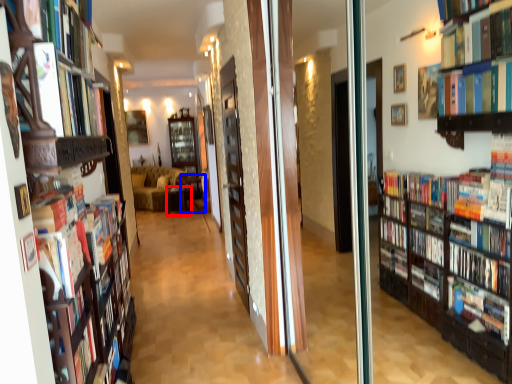
Question: Which object is further to the camera taking this photo, furniture (highlighted by a red box) or furniture (highlighted by a blue box)?

Choices:
 (A) furniture
 (B) furniture

Answer: (A)